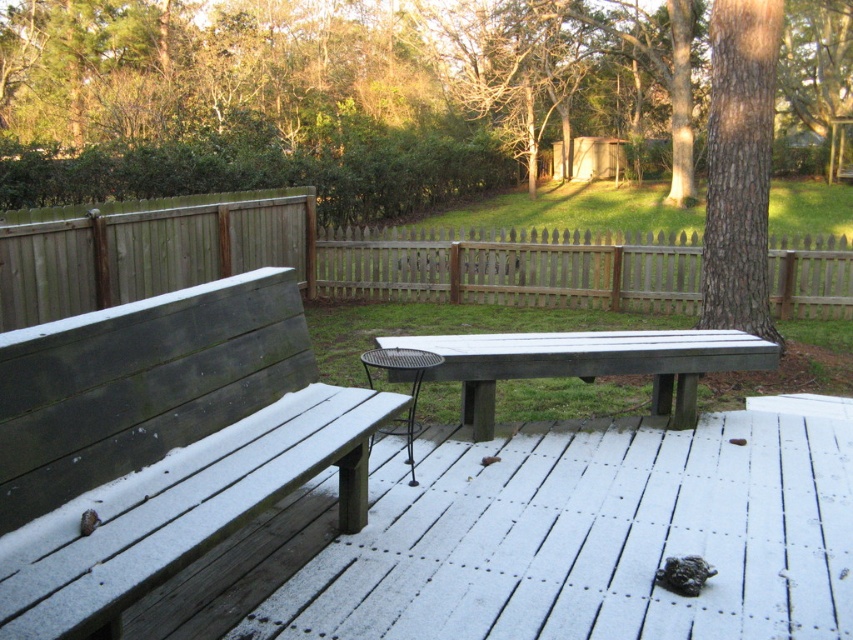
You are a painter who wants to set up an easel between the wooden bench at left and the matte gray picnic table at center. Since the easel requires a certain height to be stable, which object should you place it closer to for better stability?

The wooden bench at left is taller than the matte gray picnic table at center, so placing the easel closer to the wooden bench at left would provide better stability due to its greater height.

You are planning to place a large rectangular plant pot that is 1.2 meters wide between the wooden bench at left and the wooden picket fence at center. Based on the scene, can you determine if the space between them is wide enough to accommodate the plant pot?

The wooden bench at left might be wider than the wooden picket fence at center, so the space between them may not be wide enough for the 1.2 meters wide plant pot. Please measure the distance first before placing the pot.